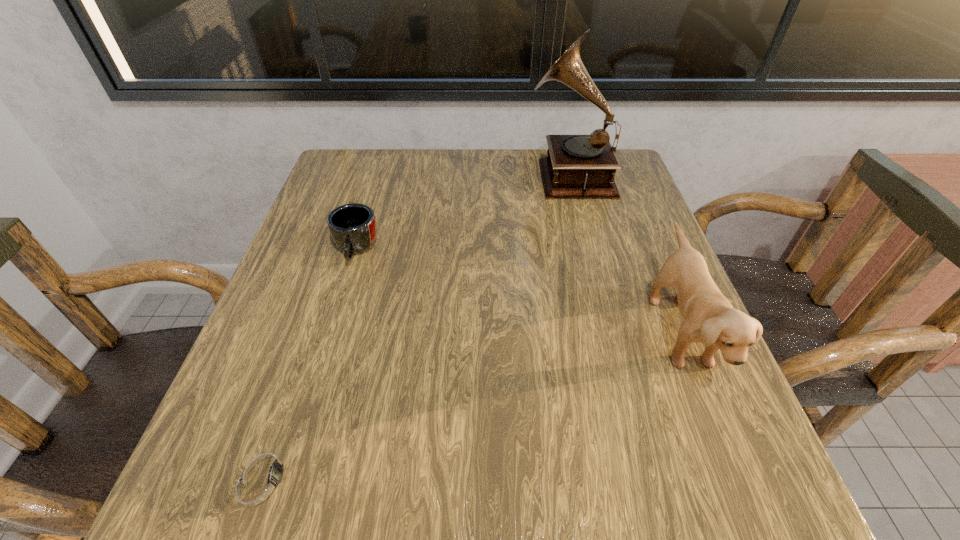
Where is `free space between the farthest object and the mug`? This screenshot has width=960, height=540. free space between the farthest object and the mug is located at coordinates (463, 213).

At what (x,y) coordinates should I click in order to perform the action: click on vacant space in between the second tallest object and the tallest object. Please return your answer as a coordinate pair (x, y). The height and width of the screenshot is (540, 960). Looking at the image, I should click on (624, 253).

In order to click on vacant area that lies between the mug and the farthest object in this screenshot , I will do `click(463, 213)`.

The height and width of the screenshot is (540, 960). Find the location of `vacant region between the shortest object and the third tallest object`. vacant region between the shortest object and the third tallest object is located at coordinates (310, 363).

Where is `free point between the record player and the puppy`? free point between the record player and the puppy is located at coordinates 624,253.

Identify the location of free space between the record player and the shortest object. (417, 326).

Where is `free space between the third tallest object and the tallest object`? This screenshot has height=540, width=960. free space between the third tallest object and the tallest object is located at coordinates (463, 213).

Find the location of a particular element. The height and width of the screenshot is (540, 960). blank region between the farthest object and the nearest object is located at coordinates (417, 326).

Identify the location of object that is the nearest to the puppy. (577, 166).

At what (x,y) coordinates should I click in order to perform the action: click on object that can be found as the third closest to the shortest object. Please return your answer as a coordinate pair (x, y). This screenshot has height=540, width=960. Looking at the image, I should click on (577, 166).